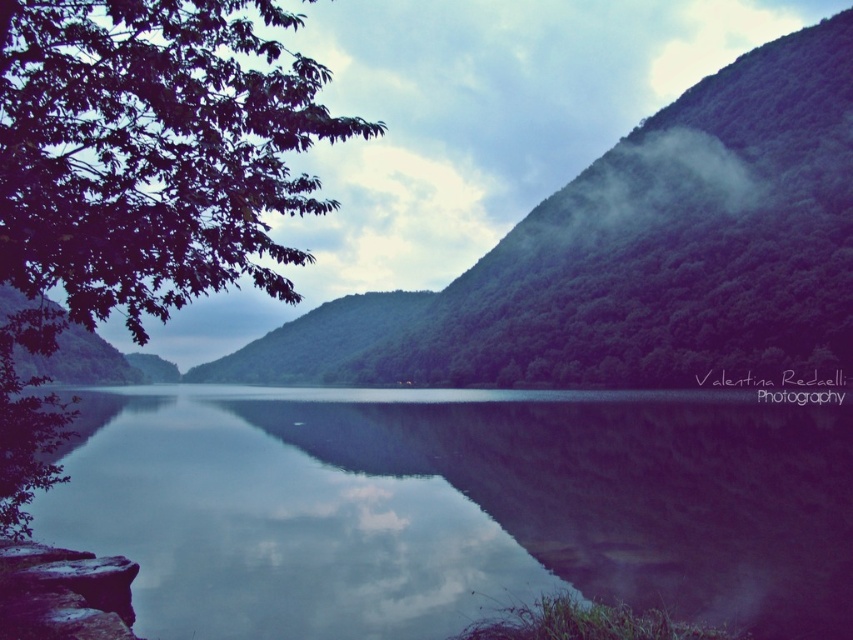
You are standing at the edge of the water and want to see the reflection of the green leafy hillside at upper left. Which direction should you look to see its reflection in the glossy water at center?

The glossy water at center is below the green leafy hillside at upper left, so you should look downward into the glossy water at center to see its reflection.

Consider the image. You are standing at the edge of the glossy water at center and want to walk towards the green leafy hillside at upper left. Which direction should you head to reach the hillside?

The glossy water at center has a lesser width compared to green leafy hillside at upper left. To reach the green leafy hillside at upper left, you should head towards the upper left direction from the glossy water at center.